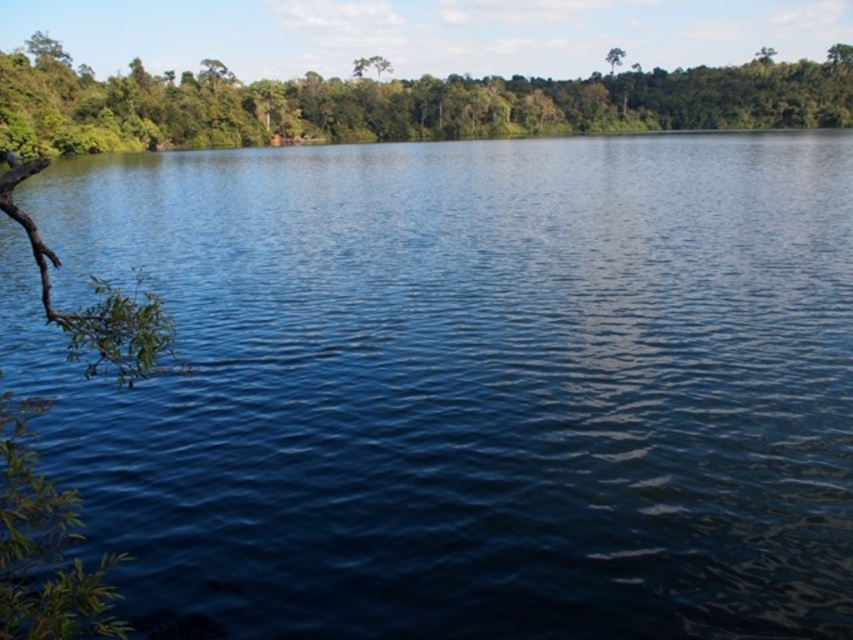
Who is taller, green leafy tree at upper left or green leafy tree at upper center?

green leafy tree at upper left

Is point (154, 88) in front of point (612, 67)?

Yes, it is.

Where is `green leafy tree at upper left`? The height and width of the screenshot is (640, 853). green leafy tree at upper left is located at coordinates (393, 104).